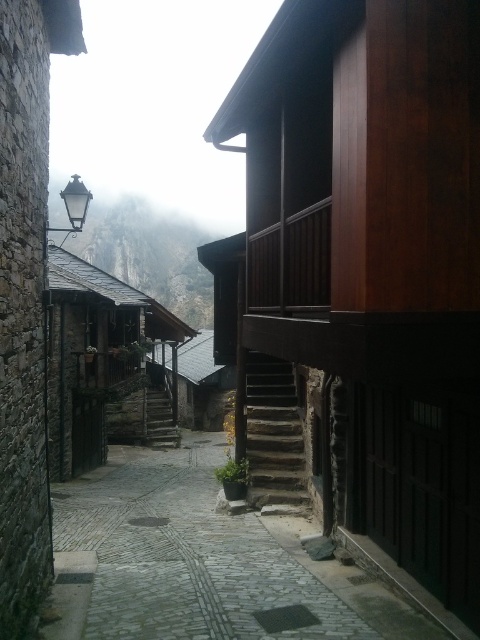
Is rugged stone mountain at upper left further to camera compared to stone textured stairs at center?

That is True.

Is point (144, 266) positioned after point (291, 404)?

Yes, point (144, 266) is farther from viewer.

This screenshot has width=480, height=640. In order to click on rugged stone mountain at upper left in this screenshot , I will do `click(149, 256)`.

Based on the photo, can you confirm if cobblestone path at center is shorter than stone textured stairs at center?

Yes, cobblestone path at center is shorter than stone textured stairs at center.

Is cobblestone path at center to the right of stone textured stairs at center from the viewer's perspective?

In fact, cobblestone path at center is to the left of stone textured stairs at center.

Identify the location of cobblestone path at center. This screenshot has height=640, width=480. (186, 556).

At what (x,y) coordinates should I click in order to perform the action: click on cobblestone path at center. Please return your answer as a coordinate pair (x, y). Looking at the image, I should click on (186, 556).

Can you confirm if cobblestone path at center is positioned above rugged stone mountain at upper left?

Actually, cobblestone path at center is below rugged stone mountain at upper left.

Which is behind, point (94, 620) or point (133, 268)?

Point (133, 268)

Find the location of `cobblestone path at center`. cobblestone path at center is located at coordinates (186, 556).